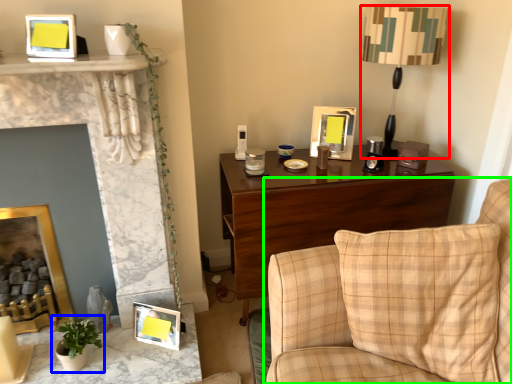
Question: Based on their relative distances, which object is farther from table lamp (highlighted by a red box)? Choose from houseplant (highlighted by a blue box) and studio couch (highlighted by a green box).

Choices:
 (A) houseplant
 (B) studio couch

Answer: (A)